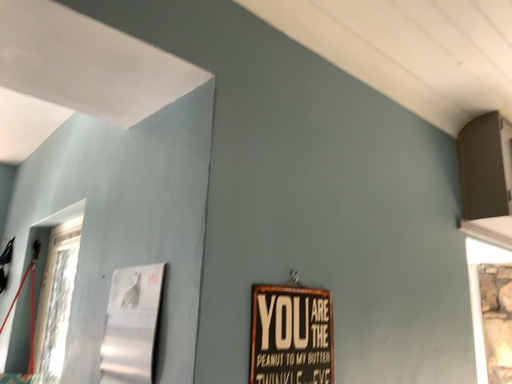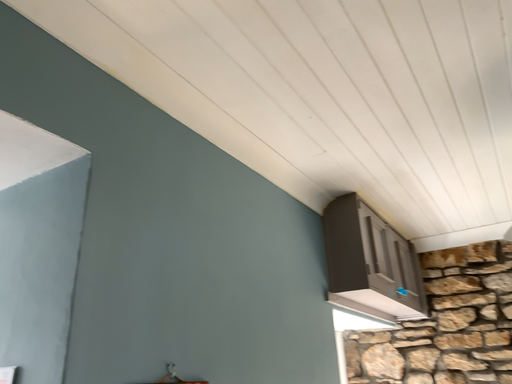
Question: How did the camera likely rotate when shooting the video?

Choices:
 (A) rotated left
 (B) rotated right

Answer: (B)